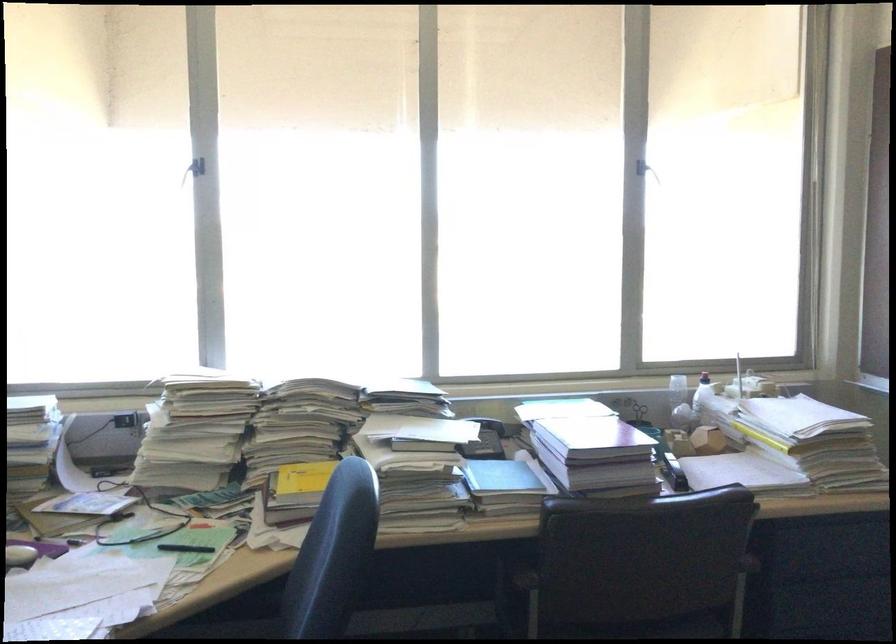
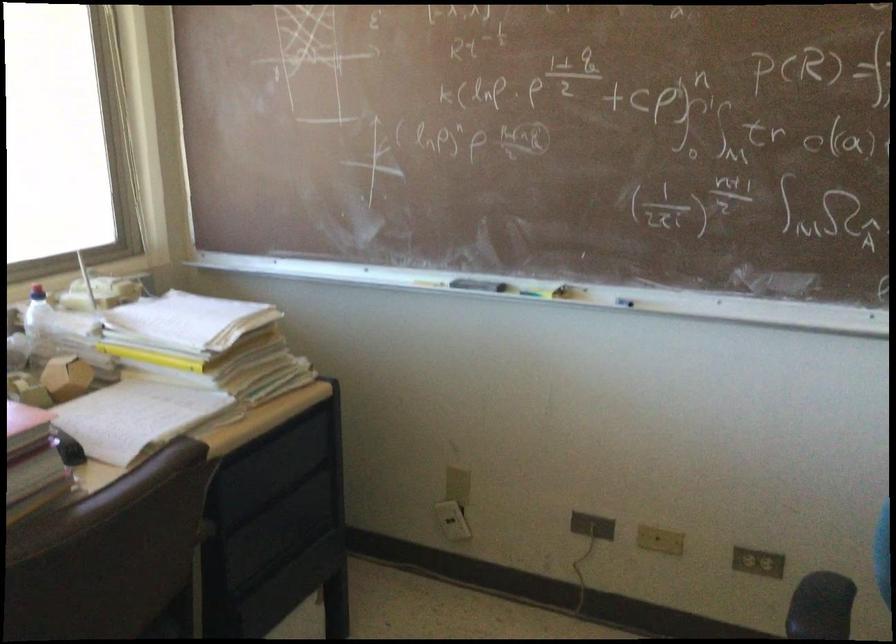
The point at (713, 433) is marked in the first image. Where is the corresponding point in the second image?

(65, 377)